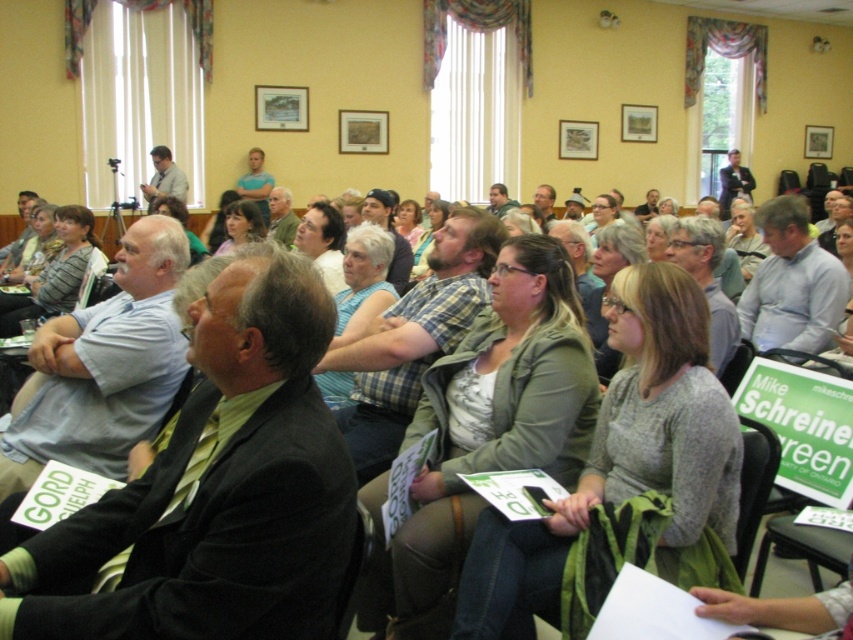
Who is positioned more to the left, black suit at center or matte gray shirt at center?

black suit at center is more to the left.

Can you confirm if black suit at center is positioned below matte gray shirt at center?

Correct, black suit at center is located below matte gray shirt at center.

Does point (274, 362) lie behind point (544, 202)?

No, it is in front of (544, 202).

The height and width of the screenshot is (640, 853). What are the coordinates of `black suit at center` in the screenshot? It's located at (215, 490).

Does gray cotton shirt at left lie in front of green fabric shirt at center?

Yes, gray cotton shirt at left is closer to the viewer.

Is gray cotton shirt at left further to camera compared to green fabric shirt at center?

No.

What do you see at coordinates (102, 368) in the screenshot? The height and width of the screenshot is (640, 853). I see `gray cotton shirt at left` at bounding box center [102, 368].

The width and height of the screenshot is (853, 640). Find the location of `gray cotton shirt at left`. gray cotton shirt at left is located at coordinates (102, 368).

What do you see at coordinates (363, 282) in the screenshot?
I see `light blue shirt at center` at bounding box center [363, 282].

Identify the location of light blue shirt at center. This screenshot has width=853, height=640. click(363, 282).